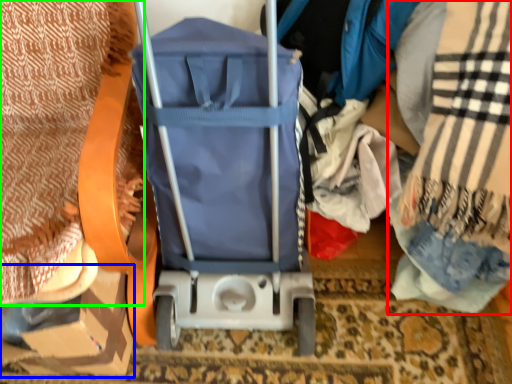
Question: Estimate the real-world distances between objects in this image. Which object is farther from blanket (highlighted by a red box), cardboard box (highlighted by a blue box) or blanket (highlighted by a green box)?

Choices:
 (A) cardboard box
 (B) blanket

Answer: (B)